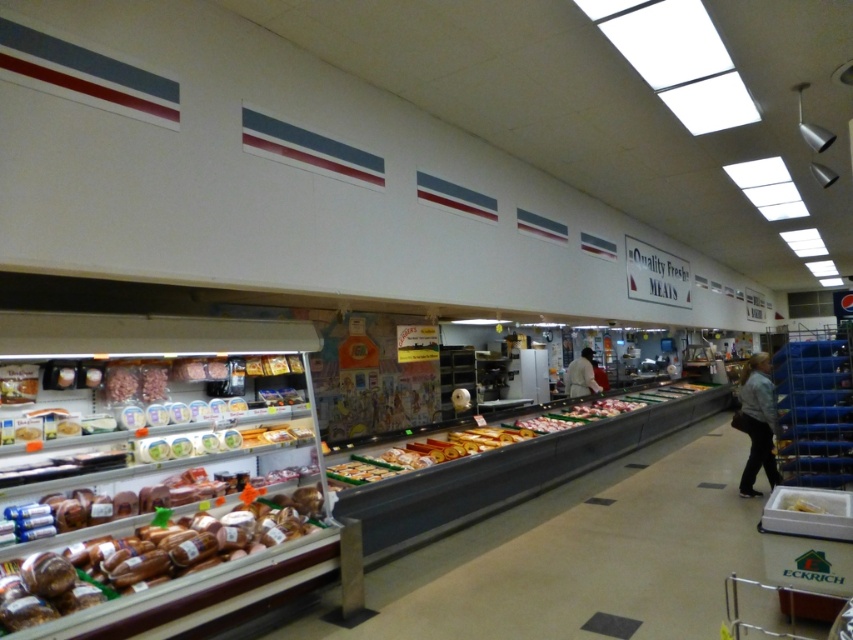
Does brown glossy bread at lower left appear over yellow matte cheese at center?

No, brown glossy bread at lower left is not above yellow matte cheese at center.

Locate an element on the screen. brown glossy bread at lower left is located at coordinates (151, 572).

Can you confirm if white matte coat at center is positioned above yellow matte cheese at center?

Correct, white matte coat at center is located above yellow matte cheese at center.

Does point (589, 380) lie in front of point (799, 506)?

No, (589, 380) is further to viewer.

Where is `white matte coat at center`? The height and width of the screenshot is (640, 853). white matte coat at center is located at coordinates (579, 376).

At what (x,y) coordinates should I click in order to perform the action: click on white matte coat at center. Please return your answer as a coordinate pair (x, y). Looking at the image, I should click on (579, 376).

Which is more to the right, brown glossy bread at lower left or denim jacket at lower right?

denim jacket at lower right is more to the right.

Where is `brown glossy bread at lower left`? The image size is (853, 640). brown glossy bread at lower left is located at coordinates (x=151, y=572).

Where is `brown glossy bread at lower left`? The height and width of the screenshot is (640, 853). brown glossy bread at lower left is located at coordinates (151, 572).